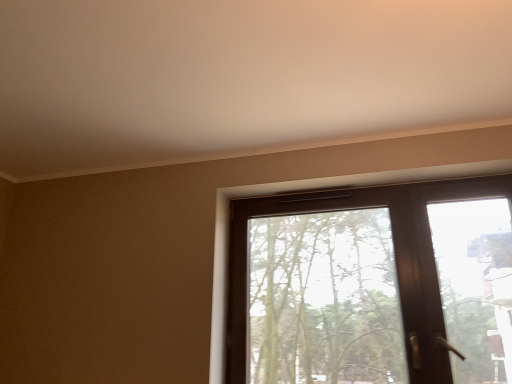
Describe the element at coordinates (373, 285) in the screenshot. I see `brown matte window at right` at that location.

At what (x,y) coordinates should I click in order to perform the action: click on brown matte window at right. Please return your answer as a coordinate pair (x, y). This screenshot has width=512, height=384. Looking at the image, I should click on (373, 285).

Locate an element on the screen. brown matte window at right is located at coordinates (373, 285).